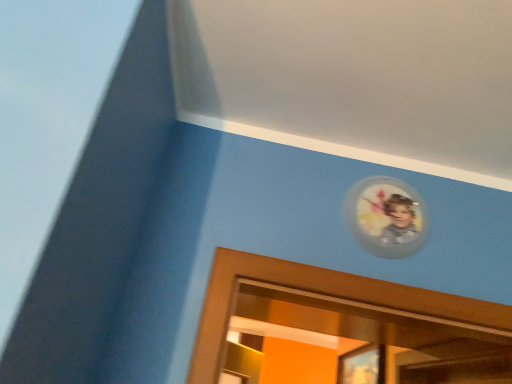
You are a GUI agent. You are given a task and a screenshot of the screen. Output one action in this format:
    pyautogui.click(x=<x>, y=<y>)
    Task: Click on the transparent plastic picture frame at upper right
    The width and height of the screenshot is (512, 384).
    Given the screenshot: What is the action you would take?
    pyautogui.click(x=386, y=217)

Image resolution: width=512 pixels, height=384 pixels. What do you see at coordinates (386, 217) in the screenshot?
I see `transparent plastic picture frame at upper right` at bounding box center [386, 217].

Describe the element at coordinates (362, 365) in the screenshot. This screenshot has width=512, height=384. I see `matte wooden portrait at upper center` at that location.

The image size is (512, 384). I want to click on matte wooden portrait at upper center, so click(362, 365).

Locate an element on the screen. transparent plastic picture frame at upper right is located at coordinates (386, 217).

Does transparent plastic picture frame at upper right appear on the left side of matte wooden portrait at upper center?

Yes.

Which is behind, transparent plastic picture frame at upper right or matte wooden portrait at upper center?

matte wooden portrait at upper center.

Between point (382, 178) and point (346, 368), which one is positioned behind?

Point (346, 368)

From the image's perspective, is transparent plastic picture frame at upper right under matte wooden portrait at upper center?

No.

From a real-world perspective, which is physically below, transparent plastic picture frame at upper right or matte wooden portrait at upper center?

In real-world perspective, matte wooden portrait at upper center is lower.

Can you confirm if transparent plastic picture frame at upper right is wider than matte wooden portrait at upper center?

No, transparent plastic picture frame at upper right is not wider than matte wooden portrait at upper center.

Can you confirm if transparent plastic picture frame at upper right is taller than matte wooden portrait at upper center?

Yes, transparent plastic picture frame at upper right is taller than matte wooden portrait at upper center.

Does transparent plastic picture frame at upper right have a smaller size compared to matte wooden portrait at upper center?

Indeed, transparent plastic picture frame at upper right has a smaller size compared to matte wooden portrait at upper center.

Is transparent plastic picture frame at upper right inside or outside of matte wooden portrait at upper center?

transparent plastic picture frame at upper right is outside matte wooden portrait at upper center.

Is transparent plastic picture frame at upper right not close to matte wooden portrait at upper center?

transparent plastic picture frame at upper right is far away from matte wooden portrait at upper center.

Is transparent plastic picture frame at upper right looking in the opposite direction of matte wooden portrait at upper center?

Absolutely, transparent plastic picture frame at upper right is directed away from matte wooden portrait at upper center.

How many degrees apart are the facing directions of transparent plastic picture frame at upper right and matte wooden portrait at upper center?

91.3 degrees.

Measure the distance between transparent plastic picture frame at upper right and matte wooden portrait at upper center.

A distance of 4.36 feet exists between transparent plastic picture frame at upper right and matte wooden portrait at upper center.

Image resolution: width=512 pixels, height=384 pixels. In the image, there is a matte wooden portrait at upper center. Find the location of `picture frame above it (from the image's perspective)`. picture frame above it (from the image's perspective) is located at coordinates pos(386,217).

Is matte wooden portrait at upper center at the left side of transparent plastic picture frame at upper right?

No.

From the picture: Which object is further away from the camera taking this photo, matte wooden portrait at upper center or transparent plastic picture frame at upper right?

Positioned behind is matte wooden portrait at upper center.

Between point (349, 366) and point (380, 193), which one is positioned behind?

The point (349, 366) is more distant.

From the image's perspective, is matte wooden portrait at upper center on transparent plastic picture frame at upper right?

No, from the image's perspective, matte wooden portrait at upper center is not over transparent plastic picture frame at upper right.

From a real-world perspective, is matte wooden portrait at upper center on transparent plastic picture frame at upper right?

No, from a real-world perspective, matte wooden portrait at upper center is not over transparent plastic picture frame at upper right

Considering the sizes of matte wooden portrait at upper center and transparent plastic picture frame at upper right in the image, is matte wooden portrait at upper center wider or thinner than transparent plastic picture frame at upper right?

matte wooden portrait at upper center is wider than transparent plastic picture frame at upper right.

Who is taller, matte wooden portrait at upper center or transparent plastic picture frame at upper right?

transparent plastic picture frame at upper right.

From the picture: Considering the relative sizes of matte wooden portrait at upper center and transparent plastic picture frame at upper right in the image provided, is matte wooden portrait at upper center smaller than transparent plastic picture frame at upper right?

No, matte wooden portrait at upper center is not smaller than transparent plastic picture frame at upper right.

Can transparent plastic picture frame at upper right be found inside matte wooden portrait at upper center?

Actually, transparent plastic picture frame at upper right is outside matte wooden portrait at upper center.

Are matte wooden portrait at upper center and transparent plastic picture frame at upper right located far from each other?

Indeed, matte wooden portrait at upper center is not near transparent plastic picture frame at upper right.

Is matte wooden portrait at upper center aimed at transparent plastic picture frame at upper right?

No, matte wooden portrait at upper center is not oriented towards transparent plastic picture frame at upper right.

Could you measure the distance between matte wooden portrait at upper center and transparent plastic picture frame at upper right?

matte wooden portrait at upper center and transparent plastic picture frame at upper right are 1.33 meters apart.

Where is `picture frame above the matte wooden portrait at upper center (from a real-world perspective)`? Image resolution: width=512 pixels, height=384 pixels. picture frame above the matte wooden portrait at upper center (from a real-world perspective) is located at coordinates (386, 217).

What are the coordinates of `picture frame located on the left of matte wooden portrait at upper center` in the screenshot? It's located at (386, 217).

The width and height of the screenshot is (512, 384). Identify the location of portrait that is on the right side of transparent plastic picture frame at upper right. (362, 365).